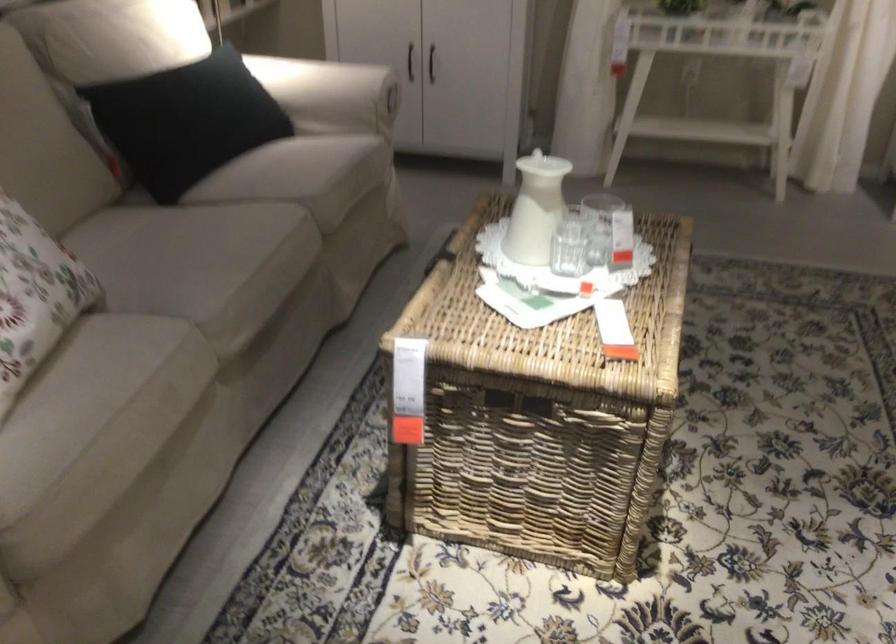
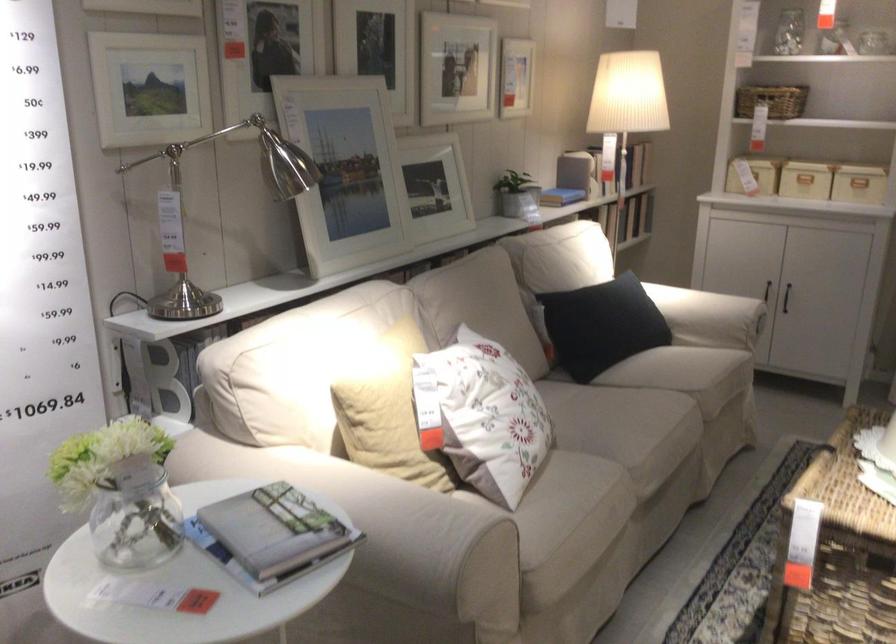
In the second image, find the point that corresponds to (399,73) in the first image.

(765, 290)